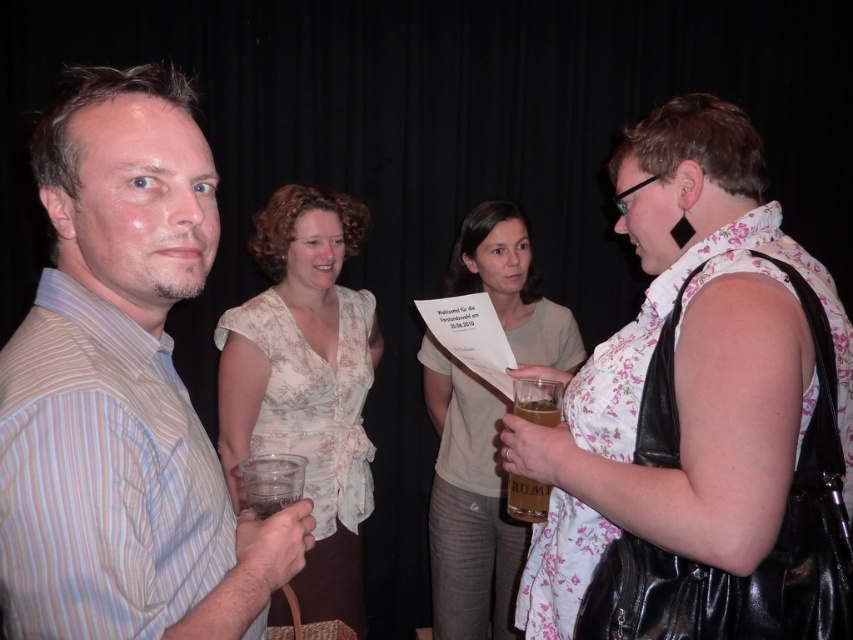
Question: Which point appears farthest from the camera in this image?

Choices:
 (A) pos(621,429)
 (B) pos(434,531)

Answer: (B)

Question: Does white paper at center appear under translucent plastic cup at lower center?

Choices:
 (A) no
 (B) yes

Answer: (B)

Question: Considering the real-world distances, which object is closest to the white paper at center?

Choices:
 (A) floral fabric dress at center
 (B) striped cotton shirt at left
 (C) translucent plastic cup at lower center

Answer: (C)

Question: Is striped cotton shirt at left to the left of translucent plastic cup at lower center from the viewer's perspective?

Choices:
 (A) yes
 (B) no

Answer: (A)

Question: Which point is farther to the camera?

Choices:
 (A) (344, 468)
 (B) (532, 406)
 (C) (239, 522)
 (D) (566, 602)

Answer: (A)

Question: Does floral fabric dress at center appear on the left side of striped cotton shirt at left?

Choices:
 (A) no
 (B) yes

Answer: (A)